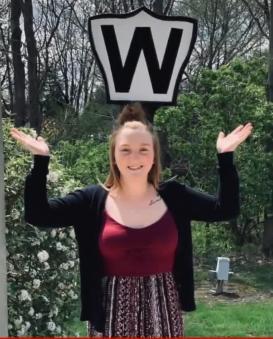
This screenshot has height=339, width=273. Identify the location of plant. (20, 266).